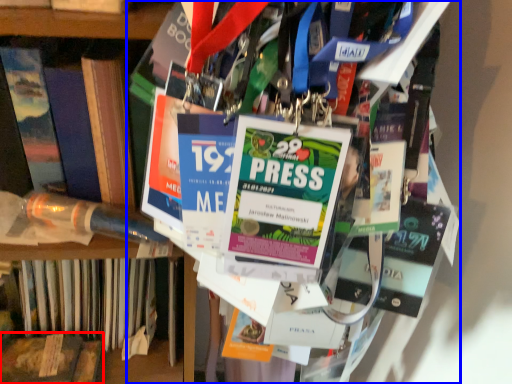
Question: Which of the following is the farthest to the observer, book (highlighted by a red box) or book (highlighted by a blue box)?

Choices:
 (A) book
 (B) book

Answer: (A)